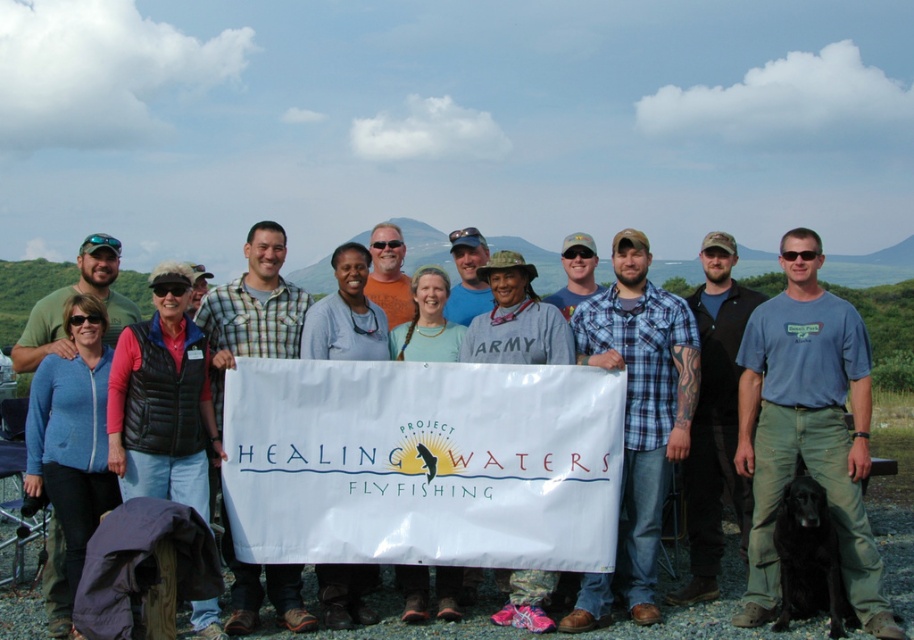
Is blue plaid shirt at center taller than blue fleece jacket at center?

No, blue plaid shirt at center is not taller than blue fleece jacket at center.

Can you confirm if blue plaid shirt at center is positioned below blue fleece jacket at center?

Indeed, blue plaid shirt at center is positioned under blue fleece jacket at center.

Does point (757, 556) lie in front of point (406, 627)?

No, (757, 556) is further to viewer.

Where is `blue plaid shirt at center`? blue plaid shirt at center is located at coordinates (806, 428).

Who is lower down, blue fleece jacket at center or matte blue zip-up jacket at center-left?

matte blue zip-up jacket at center-left is below.

Is blue fleece jacket at center to the left of matte blue zip-up jacket at center-left from the viewer's perspective?

Incorrect, blue fleece jacket at center is not on the left side of matte blue zip-up jacket at center-left.

Who is more distant from viewer, (713, 611) or (86, 348)?

The point (713, 611) is more distant.

Locate an element on the screen. blue fleece jacket at center is located at coordinates (894, 497).

Find the location of a particular element. Image resolution: width=914 pixels, height=640 pixels. blue plaid shirt at center is located at coordinates (806, 428).

Can you confirm if blue plaid shirt at center is thinner than matte blue zip-up jacket at center-left?

Yes.

Between point (846, 360) and point (72, 388), which one is positioned behind?

Point (846, 360)

The width and height of the screenshot is (914, 640). I want to click on blue plaid shirt at center, so click(806, 428).